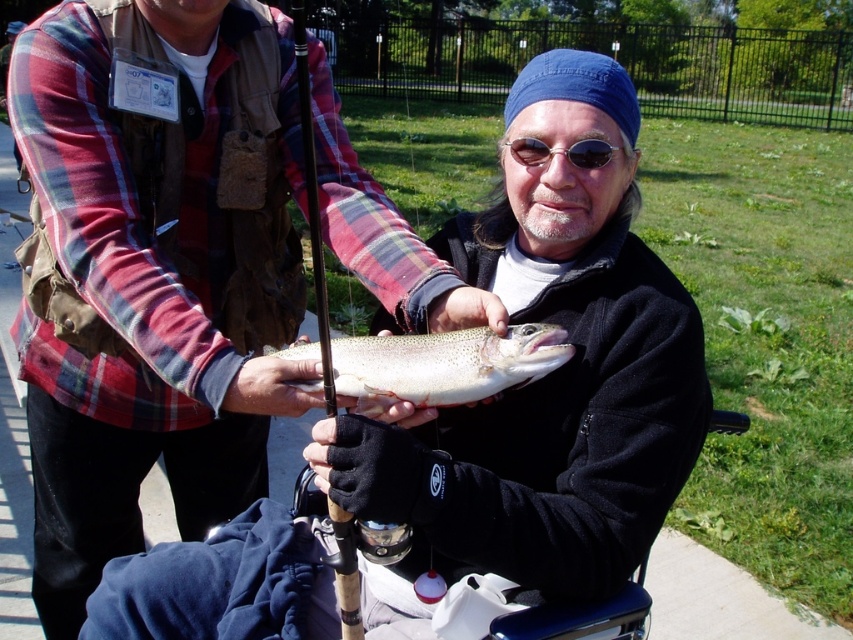
Consider the image. Is shiny silver fish at center bigger than wooden fishing pole at center?

Incorrect, shiny silver fish at center is not larger than wooden fishing pole at center.

Find the location of `shiny silver fish at center`. shiny silver fish at center is located at coordinates (447, 364).

Find the location of a particular element. shiny silver fish at center is located at coordinates (447, 364).

Where is `shiny silver fish at center`? shiny silver fish at center is located at coordinates (447, 364).

Is shiny silver fish at center taller than sunglasses at center?

Correct, shiny silver fish at center is much taller as sunglasses at center.

Find the location of a particular element. shiny silver fish at center is located at coordinates (447, 364).

At what (x,y) coordinates should I click in order to perform the action: click on shiny silver fish at center. Please return your answer as a coordinate pair (x, y). Looking at the image, I should click on [447, 364].

Which is above, shiny silver spoon at upper center or sunglasses at center?

Positioned higher is sunglasses at center.

Does shiny silver spoon at upper center have a larger size compared to sunglasses at center?

Yes.

Describe the element at coordinates (154, 273) in the screenshot. I see `shiny silver spoon at upper center` at that location.

This screenshot has width=853, height=640. Find the location of `shiny silver spoon at upper center`. shiny silver spoon at upper center is located at coordinates (154, 273).